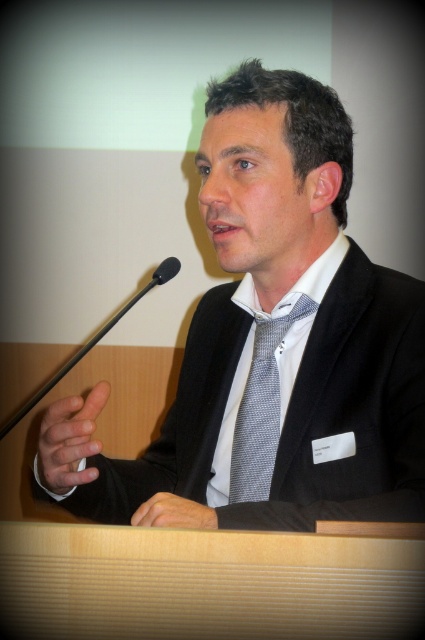
You are an event organizer who needs to ensure all speakers have proper visibility. Given the gray dotted tie at center and the black plastic microphone at left, which object is narrower?

The gray dotted tie at center is narrower than the black plastic microphone at left.

You are an event organizer and need to ensure the speaker is properly dressed for the event. Based on the image, which object is positioned to the right of the other between the black textured suit at center and the gray dotted tie at center?

The black textured suit at center is positioned to the right of the gray dotted tie at center.

You are a photographer setting up for an event. You need to ensure that the white textured dress shirt at center is in focus. What is the minimum distance you should set your camera lens to achieve this?

The minimum distance should be set to 36.54 inches to ensure the white textured dress shirt at center is in focus.